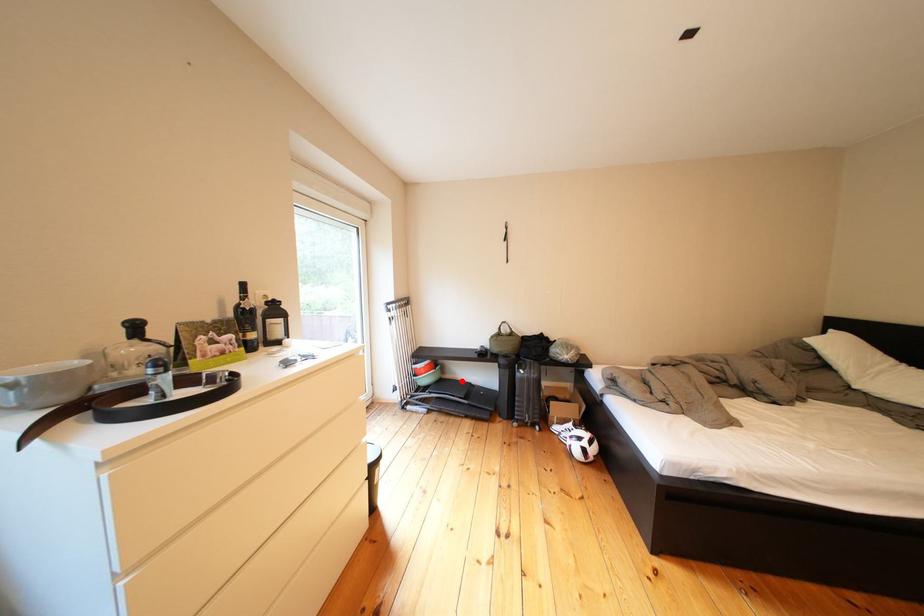
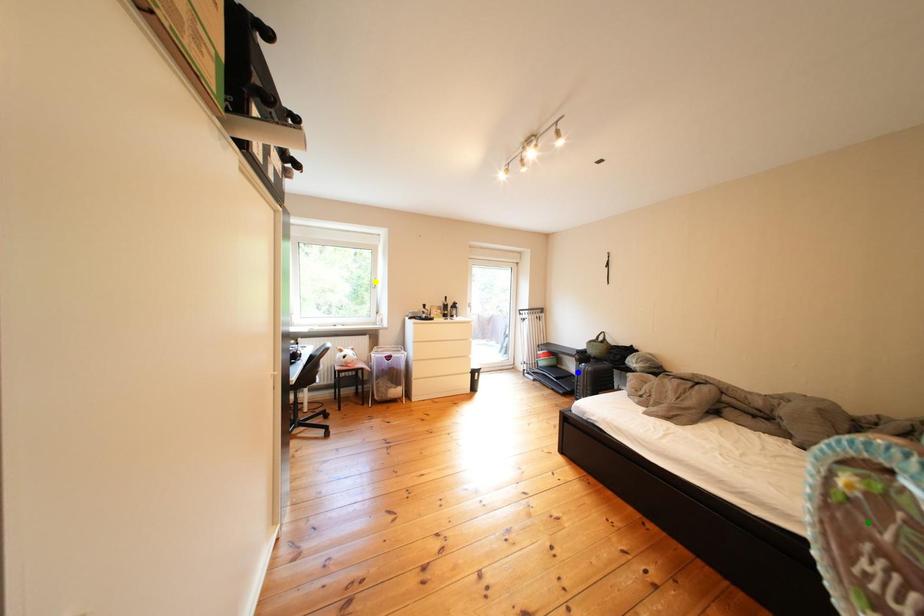
Question: I am providing you with two images of the same scene from different viewpoints. A red point is marked on the first image. You are given multiple points on the second image. Which point in image 2 is actually the same real-world point as the red point in image 1?

Choices:
 (A) green point
 (B) yellow point
 (C) blue point

Answer: (C)